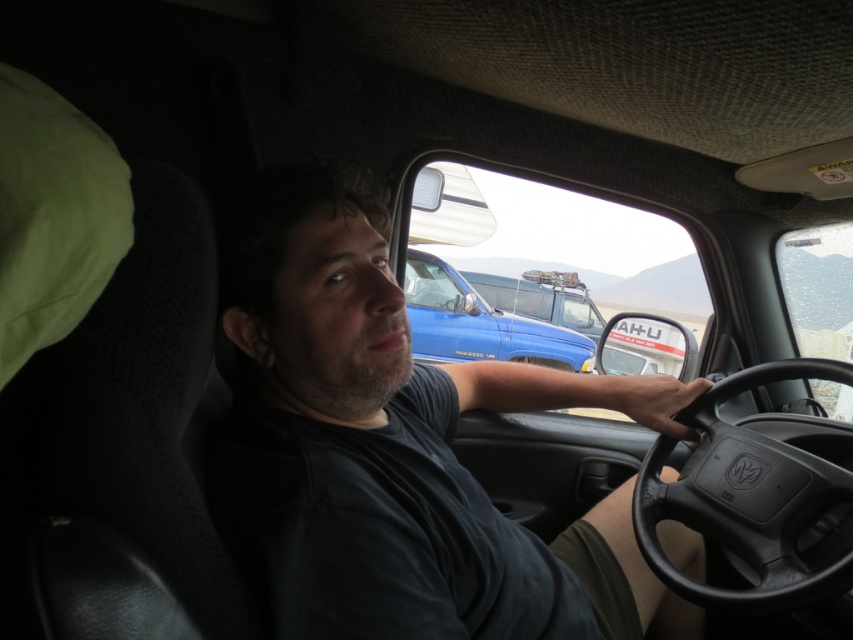
Does black leather steering wheel at center have a larger size compared to matte blue truck at center?

Incorrect, black leather steering wheel at center is not larger than matte blue truck at center.

Can you confirm if black leather steering wheel at center is wider than matte blue truck at center?

No, black leather steering wheel at center is not wider than matte blue truck at center.

Is point (786, 460) less distant than point (502, 276)?

That is True.

Locate an element on the screen. This screenshot has width=853, height=640. black leather steering wheel at center is located at coordinates (752, 500).

Is dark gray shirt at center to the left of black leather steering wheel at center from the viewer's perspective?

Correct, you'll find dark gray shirt at center to the left of black leather steering wheel at center.

Does dark gray shirt at center have a greater height compared to black leather steering wheel at center?

Yes.

The height and width of the screenshot is (640, 853). What do you see at coordinates (399, 451) in the screenshot? I see `dark gray shirt at center` at bounding box center [399, 451].

At what (x,y) coordinates should I click in order to perform the action: click on dark gray shirt at center. Please return your answer as a coordinate pair (x, y). This screenshot has width=853, height=640. Looking at the image, I should click on (399, 451).

Which of these two, dark gray shirt at center or matte blue truck at center, stands taller?

With more height is dark gray shirt at center.

The height and width of the screenshot is (640, 853). In order to click on dark gray shirt at center in this screenshot , I will do `click(399, 451)`.